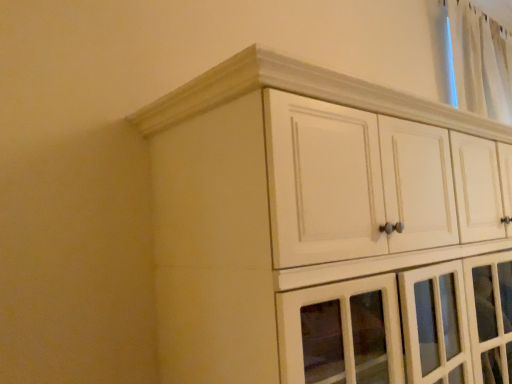
Describe the element at coordinates (481, 62) in the screenshot. This screenshot has width=512, height=384. I see `white sheer curtain at upper right` at that location.

The image size is (512, 384). Identify the location of white sheer curtain at upper right. (481, 62).

Measure the distance between point (x=472, y=80) and camera.

Point (x=472, y=80) is 2.48 meters from camera.

Describe the element at coordinates (322, 228) in the screenshot. I see `white wood cupboard at upper center` at that location.

What is the approximate height of white wood cupboard at upper center?

1.16 meters.

The image size is (512, 384). I want to click on white wood cupboard at upper center, so click(322, 228).

Where is `white sheer curtain at upper right`? The image size is (512, 384). white sheer curtain at upper right is located at coordinates (481, 62).

Which is more to the right, white sheer curtain at upper right or white wood cupboard at upper center?

white sheer curtain at upper right is more to the right.

From the picture: Relative to white wood cupboard at upper center, is white sheer curtain at upper right in front or behind?

white sheer curtain at upper right is positioned farther from the viewer than white wood cupboard at upper center.

Is point (480, 76) closer or farther from the camera than point (279, 345)?

Clearly, point (480, 76) is more distant from the camera than point (279, 345).

From the image's perspective, is white sheer curtain at upper right above or below white wood cupboard at upper center?

Based on their image positions, white sheer curtain at upper right is located above white wood cupboard at upper center.

Looking at this image, from a real-world perspective, who is located higher, white sheer curtain at upper right or white wood cupboard at upper center?

white sheer curtain at upper right.

Considering the relative sizes of white sheer curtain at upper right and white wood cupboard at upper center in the image provided, is white sheer curtain at upper right wider than white wood cupboard at upper center?

In fact, white sheer curtain at upper right might be narrower than white wood cupboard at upper center.

Looking at this image, is white sheer curtain at upper right shorter than white wood cupboard at upper center?

Yes.

Is white sheer curtain at upper right bigger than white wood cupboard at upper center?

Actually, white sheer curtain at upper right might be smaller than white wood cupboard at upper center.

Is white sheer curtain at upper right not within white wood cupboard at upper center?

Yes, white sheer curtain at upper right is not within white wood cupboard at upper center.

Is white sheer curtain at upper right directly adjacent to white wood cupboard at upper center?

No, white sheer curtain at upper right is not in contact with white wood cupboard at upper center.

Is white sheer curtain at upper right looking in the opposite direction of white wood cupboard at upper center?

No, white wood cupboard at upper center is not at the back of white sheer curtain at upper right.

The height and width of the screenshot is (384, 512). I want to click on curtain positioned vertically above the white wood cupboard at upper center (from a real-world perspective), so click(481, 62).

Is white wood cupboard at upper center at the right side of white sheer curtain at upper right?

In fact, white wood cupboard at upper center is to the left of white sheer curtain at upper right.

Which is in front, white wood cupboard at upper center or white sheer curtain at upper right?

white wood cupboard at upper center.

Based on the photo, which is farther from the camera, (496, 287) or (504, 116)?

The point (504, 116) is farther from the camera.

From the image's perspective, which is above, white wood cupboard at upper center or white sheer curtain at upper right?

white sheer curtain at upper right.

From a real-world perspective, is white wood cupboard at upper center positioned above or below white sheer curtain at upper right?

Clearly, from a real-world perspective, white wood cupboard at upper center is below white sheer curtain at upper right.

Between white wood cupboard at upper center and white sheer curtain at upper right, which one has smaller width?

Thinner between the two is white sheer curtain at upper right.

Can you confirm if white wood cupboard at upper center is shorter than white sheer curtain at upper right?

Incorrect, the height of white wood cupboard at upper center does not fall short of that of white sheer curtain at upper right.

Is white wood cupboard at upper center bigger or smaller than white sheer curtain at upper right?

white wood cupboard at upper center is bigger than white sheer curtain at upper right.

Is white sheer curtain at upper right inside white wood cupboard at upper center?

That's incorrect, white sheer curtain at upper right is not inside white wood cupboard at upper center.

Is white wood cupboard at upper center far from white sheer curtain at upper right?

Absolutely, white wood cupboard at upper center is distant from white sheer curtain at upper right.

Is white wood cupboard at upper center positioned with its back to white sheer curtain at upper right?

white wood cupboard at upper center is not turned away from white sheer curtain at upper right.

What's the angular difference between white wood cupboard at upper center and white sheer curtain at upper right's facing directions?

The facing directions of white wood cupboard at upper center and white sheer curtain at upper right are 0.000138 degrees apart.

Identify the location of curtain above the white wood cupboard at upper center (from the image's perspective). This screenshot has width=512, height=384. (481, 62).

This screenshot has width=512, height=384. I want to click on curtain on the right of white wood cupboard at upper center, so click(481, 62).

You are a GUI agent. You are given a task and a screenshot of the screen. Output one action in this format:
    pyautogui.click(x=<x>, y=<y>)
    Task: Click on the curtain above the white wood cupboard at upper center (from the image's perspective)
    This screenshot has width=512, height=384.
    Given the screenshot: What is the action you would take?
    pyautogui.click(x=481, y=62)